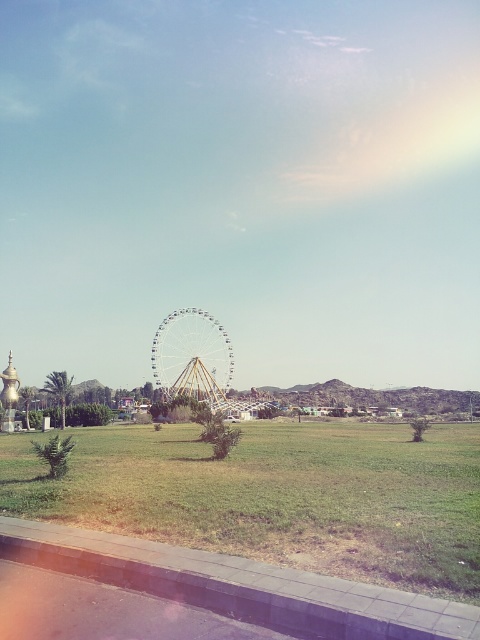
You are standing at the edge of the green grassy field at center and want to walk towards the white metallic ferris wheel at center. Which direction should you walk to get closer to the ferris wheel?

Since the green grassy field at center is closer to the viewer than the white metallic ferris wheel at center, you should walk forward towards the ferris wheel as it is further away from your current position on the field.

You are a visitor at the park and want to take a photo of the white metallic ferris wheel at center. You are currently standing on the green grassy field at center. Can you see the entire ferris wheel from your current position?

The green grassy field at center is shorter than the white metallic ferris wheel at center, so yes, you can see the entire white metallic ferris wheel at center from your current position on the green grassy field at center because the field does not obstruct the view.